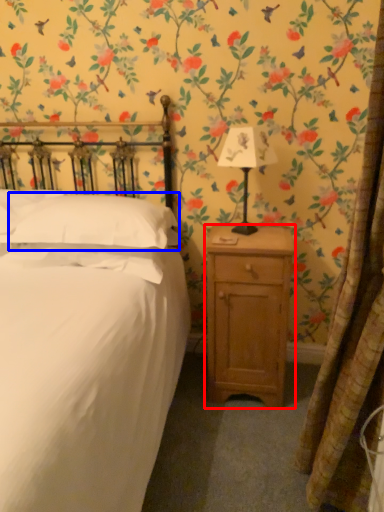
Question: Among these objects, which one is nearest to the camera, nightstand (highlighted by a red box) or pillow (highlighted by a blue box)?

Choices:
 (A) nightstand
 (B) pillow

Answer: (B)